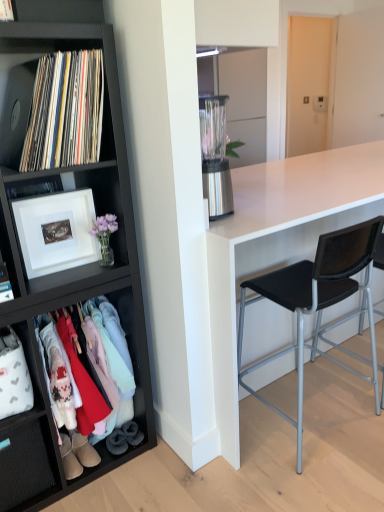
This screenshot has height=512, width=384. What are the coordinates of `vacant area that lies to the right of soft gray suede boot at lower left, which appears as the 2th shoe when viewed from the left` in the screenshot? It's located at (154, 439).